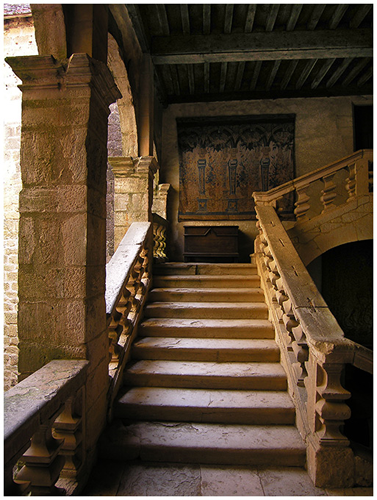
The width and height of the screenshot is (377, 500). In order to click on doorway in this screenshot , I will do `click(363, 124)`.